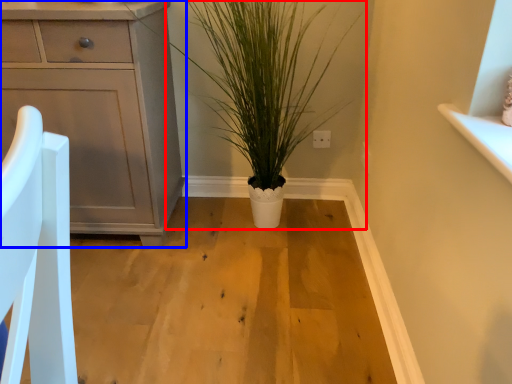
Question: Among these objects, which one is nearest to the camera, houseplant (highlighted by a red box) or chest of drawers (highlighted by a blue box)?

Choices:
 (A) houseplant
 (B) chest of drawers

Answer: (A)